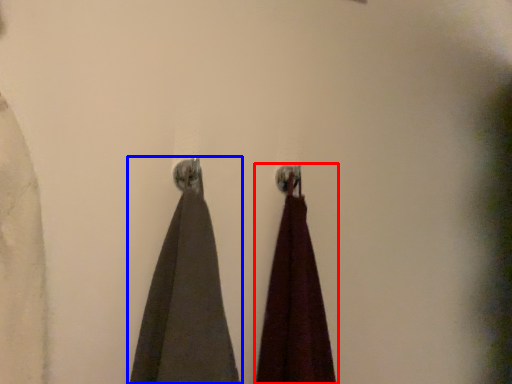
Question: Which object is closer to the camera taking this photo, curtain (highlighted by a red box) or curtain (highlighted by a blue box)?

Choices:
 (A) curtain
 (B) curtain

Answer: (B)